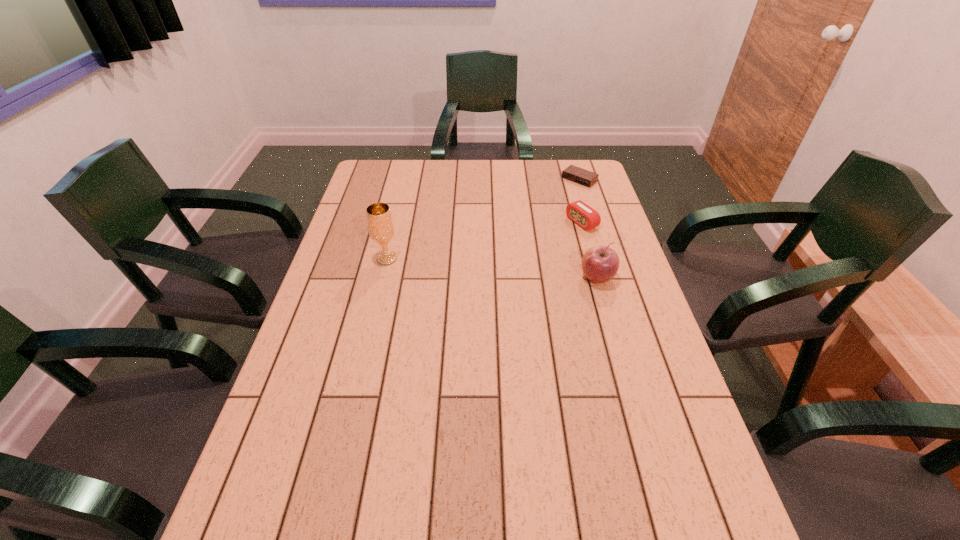
The height and width of the screenshot is (540, 960). I want to click on chalice, so click(x=380, y=225).

Identify the location of the tallest object. The width and height of the screenshot is (960, 540). (380, 225).

You are a GUI agent. You are given a task and a screenshot of the screen. Output one action in this format:
    pyautogui.click(x=<x>, y=<y>)
    Task: Click on the third shortest object
    
    Given the screenshot: What is the action you would take?
    pyautogui.click(x=600, y=263)

This screenshot has width=960, height=540. I want to click on the nearer alarm clock, so pos(583,215).

This screenshot has width=960, height=540. I want to click on the second farthest object, so click(583, 215).

Find the location of `the farthest object`. the farthest object is located at coordinates (572, 173).

Where is `the shortest object`? Image resolution: width=960 pixels, height=540 pixels. the shortest object is located at coordinates (572, 173).

In order to click on free location located on the right of the tallest object in this screenshot , I will do `click(458, 259)`.

At what (x,y) coordinates should I click in order to perform the action: click on vacant space located 0.340m on the front of the second tallest object. Please return your answer as a coordinate pair (x, y). Image resolution: width=960 pixels, height=540 pixels. Looking at the image, I should click on (631, 398).

Find the location of a particular element. Image resolution: width=960 pixels, height=540 pixels. vacant space located 0.070m on the front-facing side of the taller alarm clock is located at coordinates (554, 235).